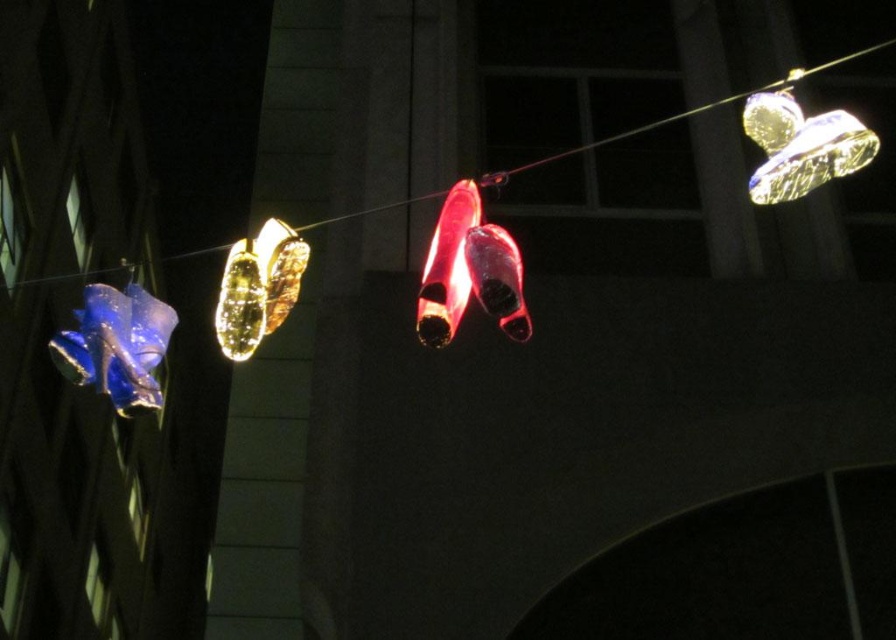
Between point (106, 368) and point (635, 129), which one is positioned in front?

Point (106, 368) is more forward.

Which is below, blue translucent shoe at left or glossy plastic shoes at center?

blue translucent shoe at left is lower down.

The image size is (896, 640). I want to click on blue translucent shoe at left, so click(117, 346).

This screenshot has height=640, width=896. Identify the location of blue translucent shoe at left. (117, 346).

Which is more to the left, metallic gold shoe at center or glossy plastic shoe at center?

From the viewer's perspective, metallic gold shoe at center appears more on the left side.

Is metallic gold shoe at center taller than glossy plastic shoe at center?

Indeed, metallic gold shoe at center has a greater height compared to glossy plastic shoe at center.

Who is more distant from viewer, (290, 230) or (453, 304)?

The point (290, 230) is more distant.

Find the location of a particular element. metallic gold shoe at center is located at coordinates (257, 288).

Is metallic gold shoe at center to the right of glossy plastic shoes at center from the viewer's perspective?

Yes, metallic gold shoe at center is to the right of glossy plastic shoes at center.

Is metallic gold shoe at center to the left of glossy plastic shoes at center from the viewer's perspective?

No, metallic gold shoe at center is not to the left of glossy plastic shoes at center.

Between point (266, 250) and point (428, 196), which one is positioned behind?

Point (428, 196)

Where is `metallic gold shoe at center`? This screenshot has width=896, height=640. metallic gold shoe at center is located at coordinates (257, 288).